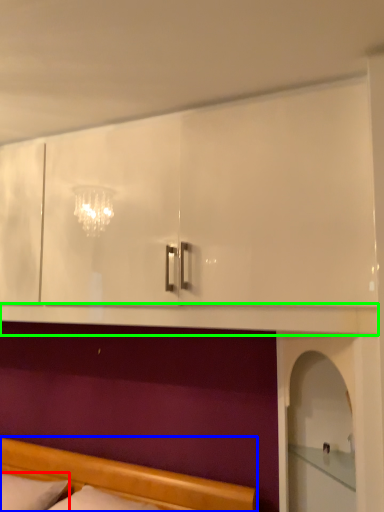
Question: Estimate the real-world distances between objects in this image. Which object is farther from pillow (highlighted by a red box), bed (highlighted by a blue box) or mantle (highlighted by a green box)?

Choices:
 (A) bed
 (B) mantle

Answer: (B)